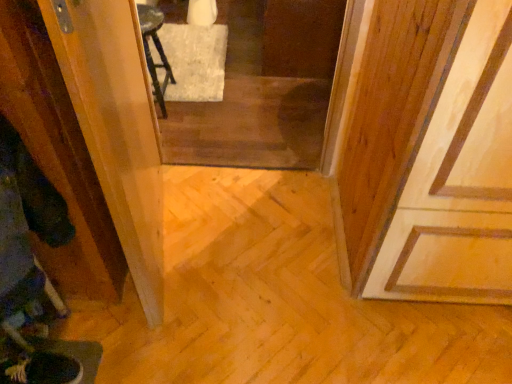
I want to click on vacant space underneath transparent plastic screen door at left, the second screen door in the back-to-front sequence (from a real-world perspective), so click(170, 238).